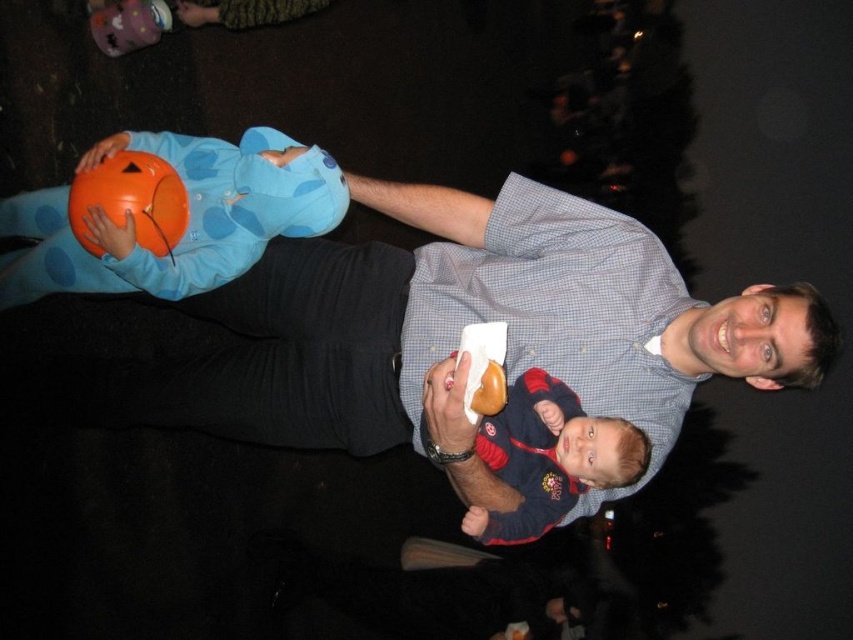
You are a photographer trying to capture a group photo of the matte blue shirt at center and the matte blue sweater at center. Which one should you focus on first if you want to ensure they are both in focus?

The matte blue shirt at center is much taller as matte blue sweater at center, so you should focus on the taller one first to ensure depth of field includes both.

You are a photographer trying to focus on two specific points in the image. The first point is at coordinates point [173,160] and the second is at point [537,429]. Which point is closer to your camera?

Point [173,160] is closer to the camera than point [537,429].